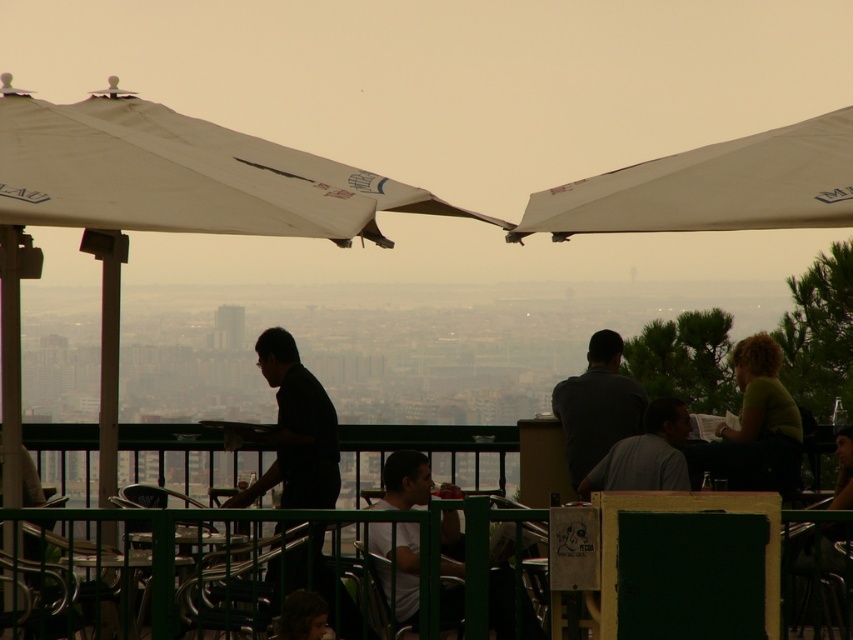
Question: Which of the following is the farthest from the observer?

Choices:
 (A) black matte shirt at center
 (B) gray matte shirt at center
 (C) dark gray shirt at center

Answer: (C)

Question: Can you confirm if green matte shirt at right is wider than metallic green chair at center?

Choices:
 (A) no
 (B) yes

Answer: (B)

Question: Which point is farther from the camera taking this photo?

Choices:
 (A) (605, 483)
 (B) (343, 198)

Answer: (A)

Question: Does gray matte shirt at center come behind green metal table at lower left?

Choices:
 (A) yes
 (B) no

Answer: (A)

Question: Considering the relative positions of white fabric canopy at upper right and dark gray shirt at center in the image provided, where is white fabric canopy at upper right located with respect to dark gray shirt at center?

Choices:
 (A) left
 (B) right

Answer: (B)

Question: Which point appears farthest from the camera in this image?

Choices:
 (A) (384, 625)
 (B) (202, 138)

Answer: (B)